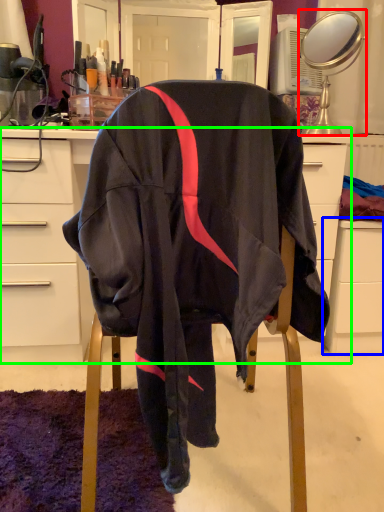
Question: Which is farther away from mirror (highlighted by a red box)? file cabinet (highlighted by a blue box) or desk (highlighted by a green box)?

Choices:
 (A) file cabinet
 (B) desk

Answer: (B)